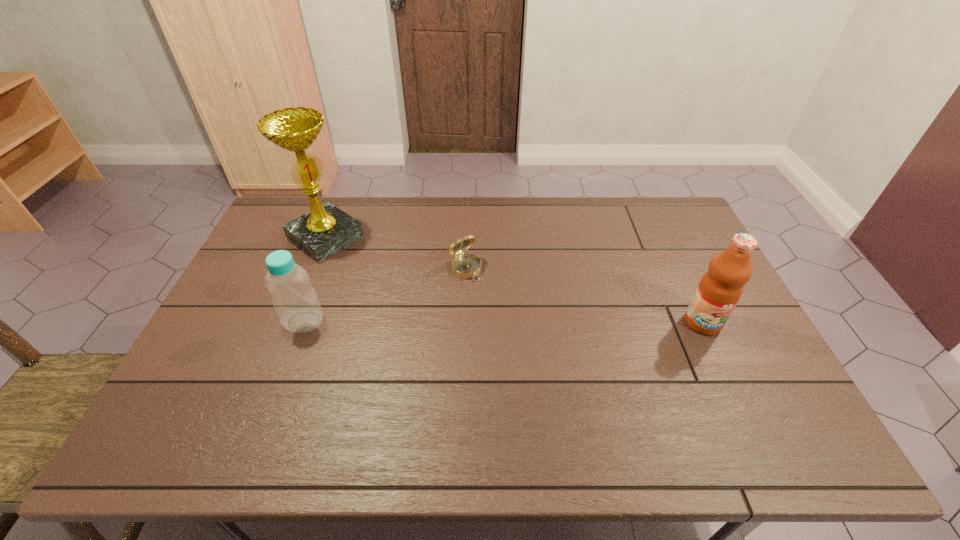
The height and width of the screenshot is (540, 960). What are the coordinates of `bottle` in the screenshot? It's located at (295, 301).

At what (x,y) coordinates should I click in order to perform the action: click on fruit juice. Please return your answer as a coordinate pair (x, y). The image size is (960, 540). Looking at the image, I should click on (719, 290).

Find the location of a particular element. the second tallest object is located at coordinates (719, 290).

Identify the location of the third object from left to right. The height and width of the screenshot is (540, 960). (465, 265).

Identify the location of the shortest object. This screenshot has width=960, height=540. (465, 265).

Where is `the tallest object`? The height and width of the screenshot is (540, 960). the tallest object is located at coordinates (325, 230).

Locate an element on the screen. The width and height of the screenshot is (960, 540). free location located on the front of the bottle is located at coordinates (275, 399).

Where is `blank space located 0.110m on the front label of the fruit juice`? This screenshot has height=540, width=960. blank space located 0.110m on the front label of the fruit juice is located at coordinates (726, 371).

Locate an element on the screen. This screenshot has height=540, width=960. vacant region located 0.360m with the dial facing the compass is located at coordinates (544, 363).

Identify the location of free region located 0.140m with the dial facing the compass. (498, 308).